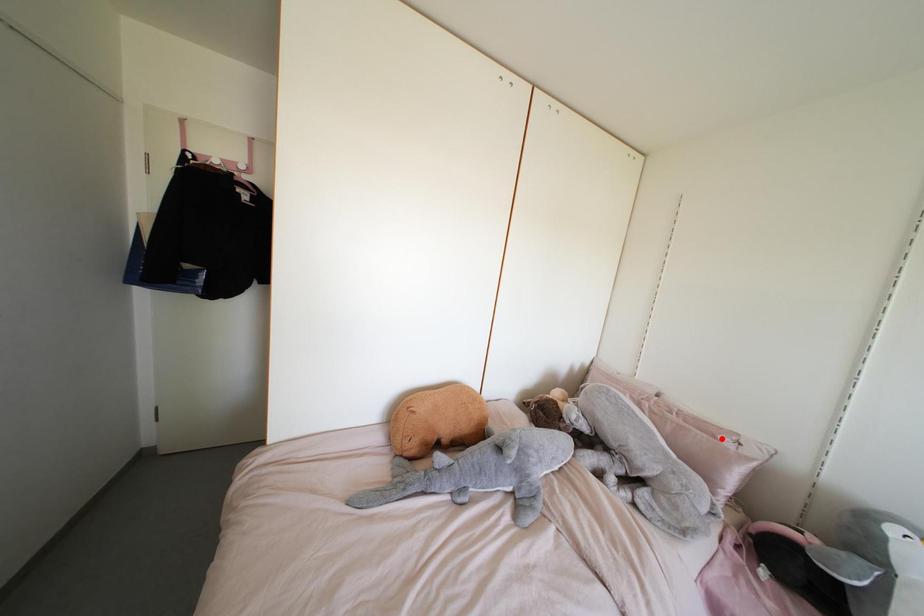
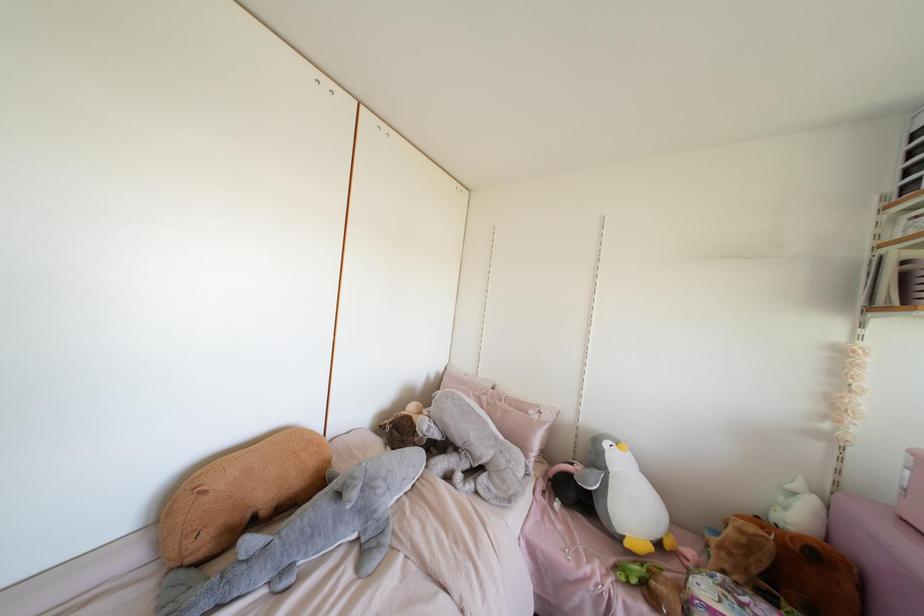
Question: I am providing you with two images of the same scene from different viewpoints. A red point is marked on the first image. Is the red point's position out of view in image 2?

Choices:
 (A) Yes
 (B) No

Answer: (B)